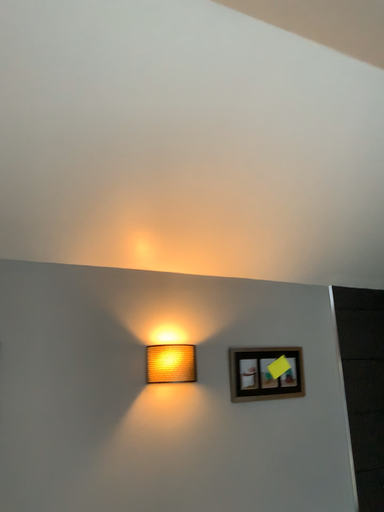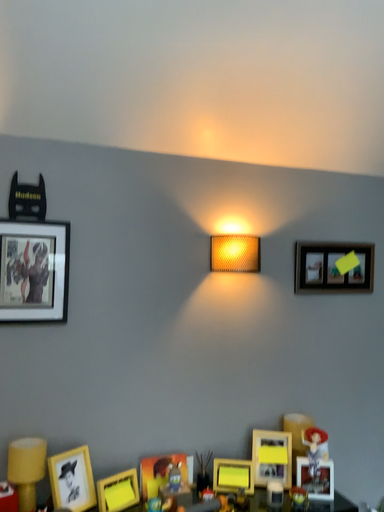
Question: Which way did the camera rotate in the video?

Choices:
 (A) rotated upward
 (B) rotated downward

Answer: (B)